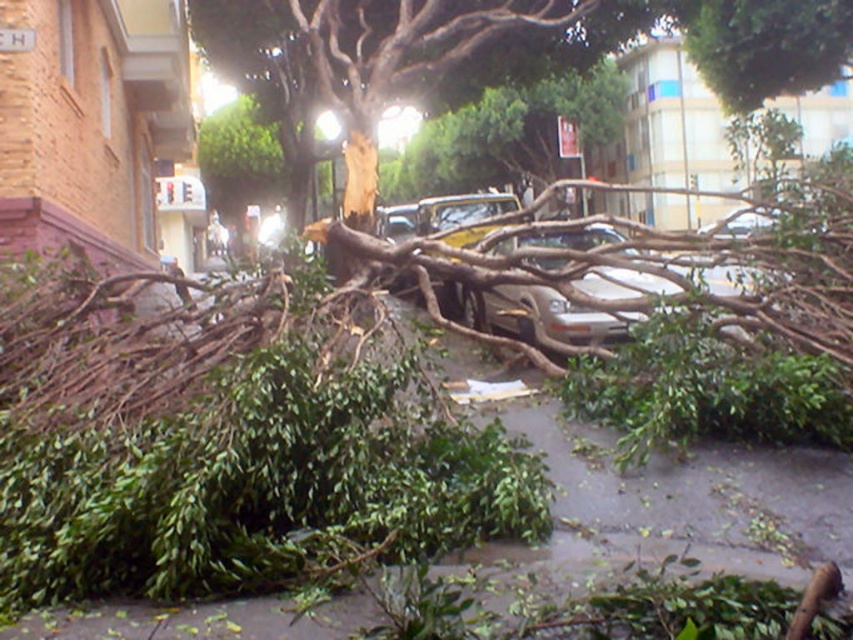
You are a city worker assessing the fallen tree. You need to clear the green leafy debris at center and the brown rough bark tree at center. Which object should you move first to access the other?

The green leafy debris at center is positioned on the left side of brown rough bark tree at center. Therefore, you should move the green leafy debris at center first to access the brown rough bark tree at center.

You are a city planner assessing the damage after a storm. You see the green leafy debris at center and the brown rough bark tree at center. Which object takes up more space in the image?

The brown rough bark tree at center takes up more space in the image than the green leafy debris at center because the green leafy debris at center is smaller than the brown rough bark tree at center.

You are a city worker assessing the fallen tree. You need to determine which object is taller between the green leafy debris at center and the brown rough bark tree at center. Which one is taller?

The brown rough bark tree at center is taller than the green leafy debris at center.